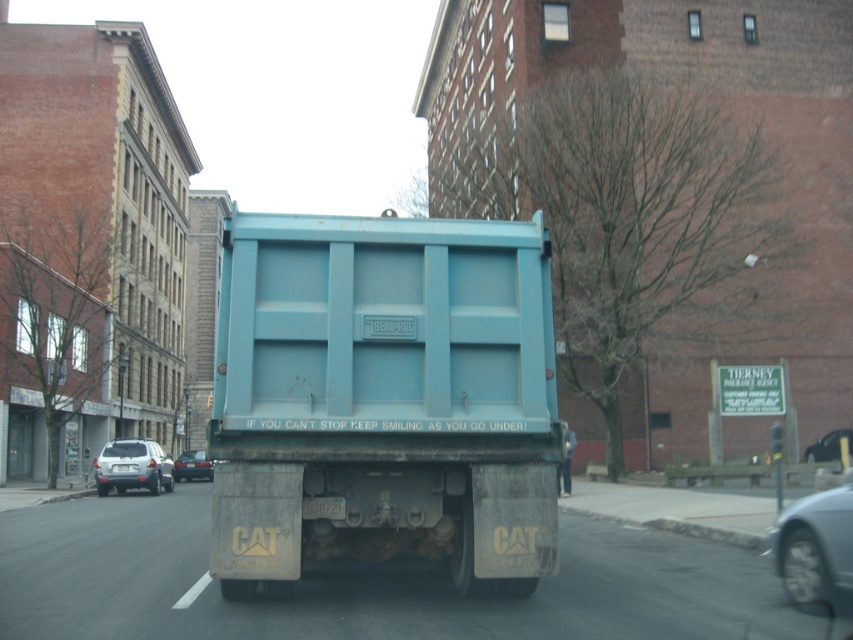
You are standing on the sidewalk and see a large blue dump truck parked on the street. There is a point marked at coordinates (x=828, y=445). Which object does this point belong to?

The point at coordinates (x=828, y=445) is on the shiny black car at center.

You are a delivery driver who needs to park your vehicle between the metallic silver car at lower right and the shiny black car at center. Given that your delivery van is 2.5 meters wide, can you fit it in the space between them?

The metallic silver car at lower right is wider than the shiny black car at center. However, the exact distance between them isn not specified in the description. Without knowing the space between the two cars, it is impossible to determine if the 2.5 meter wide delivery van can fit.

You are a pedestrian standing on the sidewalk and see the shiny black car at center and the white plastic license plate at center. Which one is closer to you?

The shiny black car at center is closer to you because it is further to the viewer than the white plastic license plate at center, meaning it occupies a nearer position in the visual field.